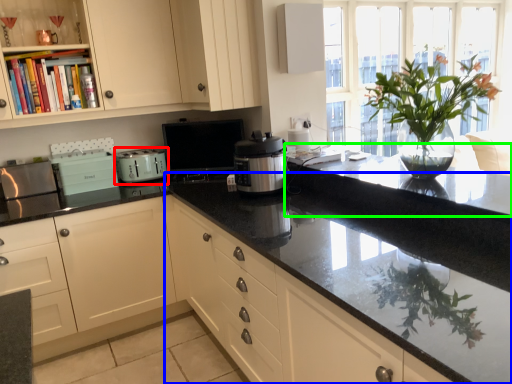
Question: Which object is the farthest from kitchen appliance (highlighted by a red box)? Choose among these: countertop (highlighted by a blue box) or countertop (highlighted by a green box).

Choices:
 (A) countertop
 (B) countertop

Answer: (B)